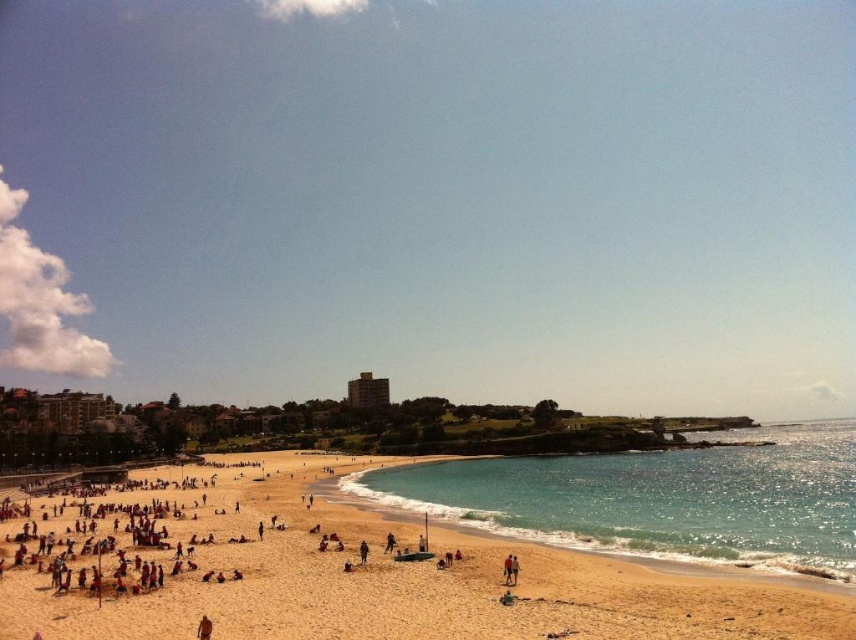
Is blue sky at upper center closer to camera compared to golden sand beach at lower left?

No, it is not.

Who is more forward, [412,228] or [97,627]?

Point [97,627] is in front.

At what (x,y) coordinates should I click in order to perform the action: click on blue sky at upper center. Please return your answer as a coordinate pair (x, y). The image size is (856, 640). Looking at the image, I should click on 432,200.

What are the coordinates of `blue sky at upper center` in the screenshot? It's located at (432, 200).

Find the location of a particular element. The height and width of the screenshot is (640, 856). blue sky at upper center is located at coordinates (432, 200).

Is blue sky at upper center smaller than clear blue water at center?

Incorrect, blue sky at upper center is not smaller in size than clear blue water at center.

Between point (7, 276) and point (611, 518), which one is positioned behind?

Point (7, 276)

Identify the location of blue sky at upper center. (432, 200).

Does golden sand beach at lower left have a lesser width compared to clear blue water at center?

Yes.

This screenshot has width=856, height=640. In order to click on golden sand beach at lower left in this screenshot , I will do `click(388, 579)`.